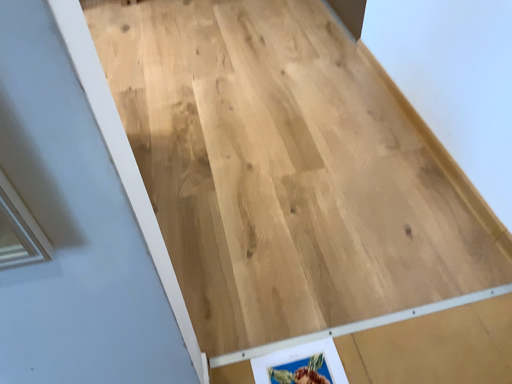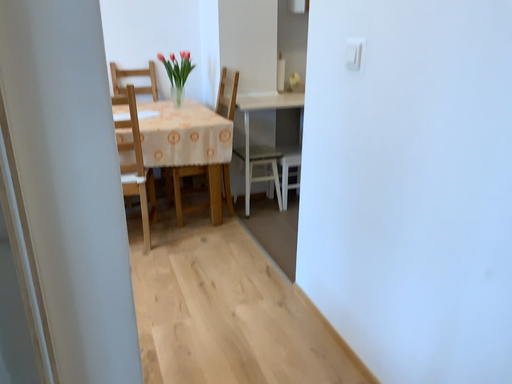
Question: Which way did the camera rotate in the video?

Choices:
 (A) rotated upward
 (B) rotated downward

Answer: (A)